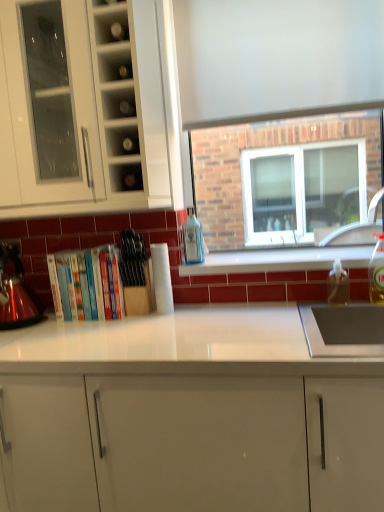
Question: From the image's perspective, would you say hardcover books at center is positioned over clear glass shelf at upper center, which ranks as the first shelf in top-to-bottom order?

Choices:
 (A) no
 (B) yes

Answer: (A)

Question: Is hardcover books at center thinner than clear glass shelf at upper center, positioned as the 2th shelf in bottom-to-top order?

Choices:
 (A) no
 (B) yes

Answer: (B)

Question: Is the position of hardcover books at center less distant than that of clear glass shelf at upper center, which ranks as the first shelf in top-to-bottom order?

Choices:
 (A) no
 (B) yes

Answer: (A)

Question: Can you confirm if hardcover books at center is taller than clear glass shelf at upper center, which ranks as the first shelf in top-to-bottom order?

Choices:
 (A) yes
 (B) no

Answer: (A)

Question: Would you say hardcover books at center is outside clear glass shelf at upper center, positioned as the 2th shelf in bottom-to-top order?

Choices:
 (A) no
 (B) yes

Answer: (B)

Question: Is white glossy cabinet at center, arranged as the first cabinetry when ordered from the bottom, taller or shorter than clear plastic bottle at right, the third bottle when ordered from back to front?

Choices:
 (A) short
 (B) tall

Answer: (B)

Question: From the image's perspective, is white glossy cabinet at center, arranged as the first cabinetry when ordered from the bottom, above or below clear plastic bottle at right, the third bottle when ordered from back to front?

Choices:
 (A) below
 (B) above

Answer: (A)

Question: Looking at the image, does white glossy cabinet at center, arranged as the first cabinetry when ordered from the bottom, seem bigger or smaller compared to clear plastic bottle at right, the third bottle when ordered from back to front?

Choices:
 (A) small
 (B) big

Answer: (B)

Question: Is white glossy cabinet at center, arranged as the first cabinetry when ordered from the bottom, inside the boundaries of clear plastic bottle at right, the third bottle in the left-to-right sequence, or outside?

Choices:
 (A) inside
 (B) outside

Answer: (B)

Question: In terms of height, does hardcover books at center look taller or shorter compared to blue glass bottle at center, which is the 3th bottle in front-to-back order?

Choices:
 (A) short
 (B) tall

Answer: (B)

Question: From the image's perspective, is hardcover books at center above or below blue glass bottle at center, which is the 3th bottle in front-to-back order?

Choices:
 (A) above
 (B) below

Answer: (B)

Question: Based on their positions, is hardcover books at center located to the left or right of blue glass bottle at center, placed as the 1th bottle when sorted from back to front?

Choices:
 (A) left
 (B) right

Answer: (A)

Question: Considering the positions of hardcover books at center and blue glass bottle at center, which is the 3th bottle in front-to-back order, in the image, is hardcover books at center bigger or smaller than blue glass bottle at center, which is the 3th bottle in front-to-back order,?

Choices:
 (A) big
 (B) small

Answer: (A)

Question: From a real-world perspective, relative to white glossy cabinet at center, arranged as the first cabinetry when ordered from the bottom, is matte glass shelf at upper center, the 1th shelf when ordered from bottom to top, vertically above or below?

Choices:
 (A) below
 (B) above

Answer: (B)

Question: Considering the positions of point [139, 186] and point [269, 452], is point [139, 186] closer or farther from the camera than point [269, 452]?

Choices:
 (A) farther
 (B) closer

Answer: (A)